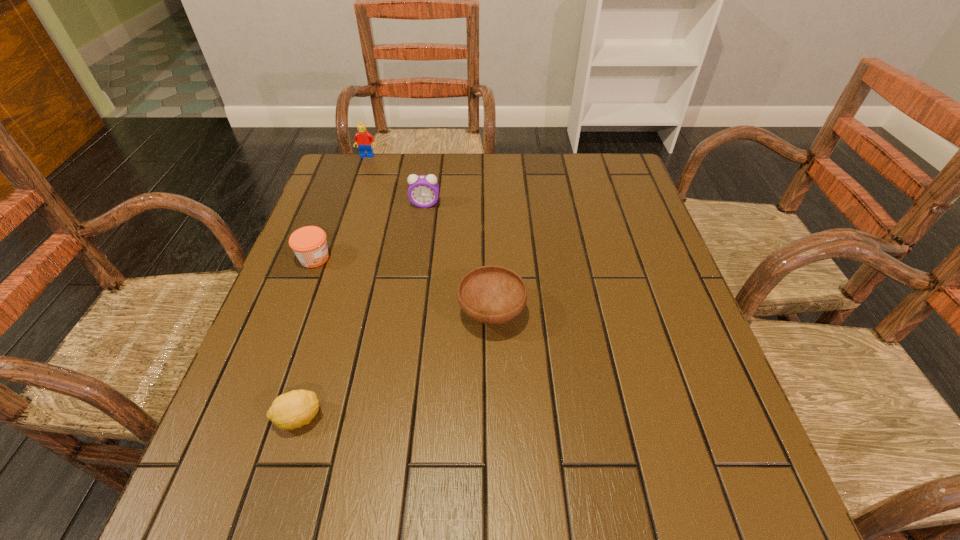
The image size is (960, 540). I want to click on vacant space positioned on the front of the bowl, so click(x=496, y=512).

Where is `free space located on the front label of the jam`? The height and width of the screenshot is (540, 960). free space located on the front label of the jam is located at coordinates (473, 258).

This screenshot has width=960, height=540. What are the coordinates of `blank area located 0.260m at the stem end of the nearest object` in the screenshot? It's located at [x=470, y=418].

Image resolution: width=960 pixels, height=540 pixels. What are the coordinates of `object that is at the far edge` in the screenshot? It's located at (364, 140).

Where is `Lego that is at the left edge`? The height and width of the screenshot is (540, 960). Lego that is at the left edge is located at coordinates (364, 140).

In order to click on jam present at the left edge in this screenshot , I will do `click(309, 243)`.

The height and width of the screenshot is (540, 960). I want to click on lemon at the left edge, so click(291, 410).

What are the coordinates of `object situated at the far left corner` in the screenshot? It's located at (364, 140).

Locate an element on the screen. blank space at the far edge is located at coordinates (540, 183).

The width and height of the screenshot is (960, 540). Find the location of `vacant space at the near edge`. vacant space at the near edge is located at coordinates tap(480, 505).